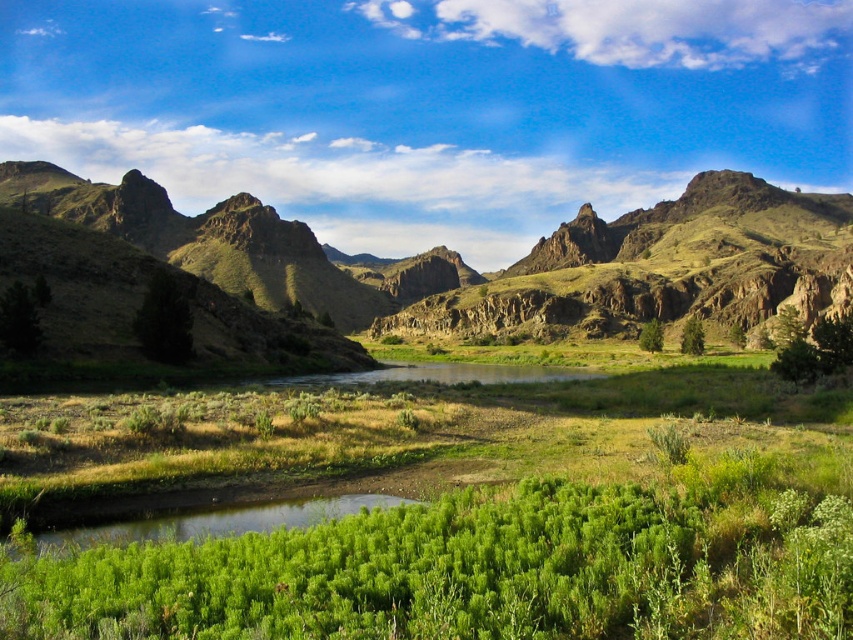
You are a GUI agent. You are given a task and a screenshot of the screen. Output one action in this format:
    pyautogui.click(x=<x>, y=<y>)
    Task: Click on the green rocky mountains at center
    
    Given the screenshot: What is the action you would take?
    pyautogui.click(x=498, y=269)

Is point (529, 323) closer to viewer compared to point (648, 346)?

No, (529, 323) is further to viewer.

At what (x,y) coordinates should I click in order to perform the action: click on green rocky mountains at center. Please return your answer as a coordinate pair (x, y). Looking at the image, I should click on (498, 269).

Is green leafy shrubs at center closer to the viewer compared to green leafy shrub at center?

That is True.

Who is taller, green leafy shrubs at center or green leafy shrub at center?

green leafy shrub at center

Is point (115, 582) less distant than point (660, 336)?

Yes, it is in front of point (660, 336).

The image size is (853, 640). Find the location of `green leafy shrubs at center`. green leafy shrubs at center is located at coordinates (486, 564).

Between green leafy shrubs at center and green rocky mountains at center, which one is positioned lower?

green leafy shrubs at center is lower down.

Between green leafy shrubs at center and green rocky mountains at center, which one appears on the left side from the viewer's perspective?

Positioned to the left is green leafy shrubs at center.

Is point (563, 508) less distant than point (247, 273)?

Yes, point (563, 508) is closer to viewer.

This screenshot has height=640, width=853. I want to click on green leafy shrubs at center, so click(486, 564).